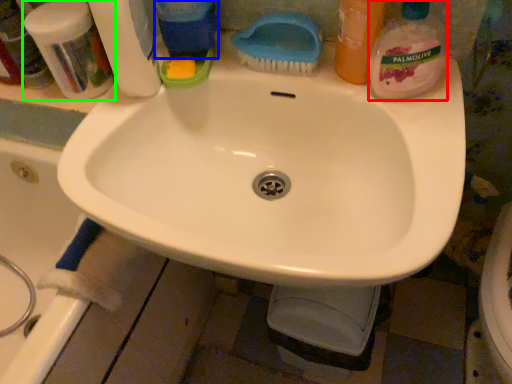
Question: Which object is the closest to the cleaning product (highlighted by a red box)? Choose among these: cleaning product (highlighted by a blue box) or toiletry (highlighted by a green box).

Choices:
 (A) cleaning product
 (B) toiletry

Answer: (A)